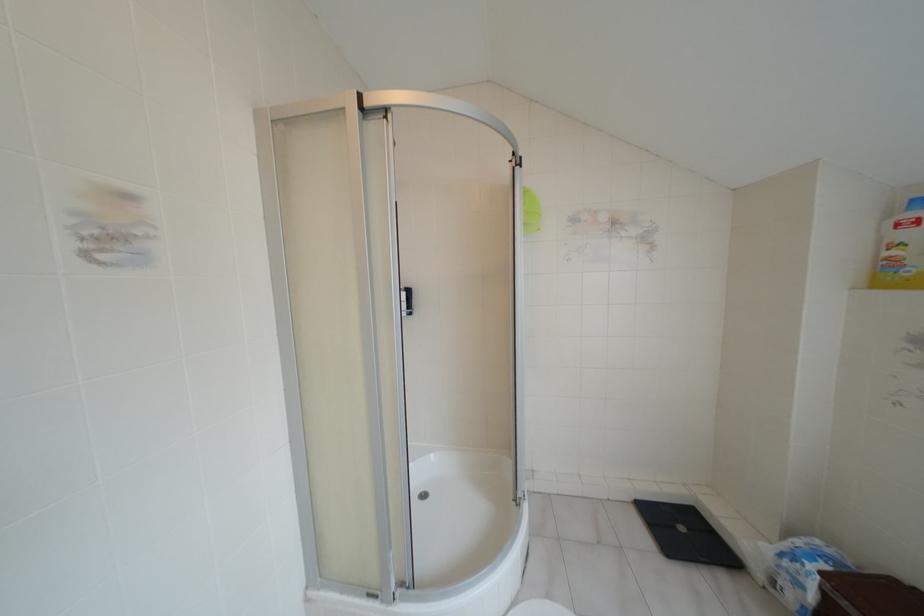
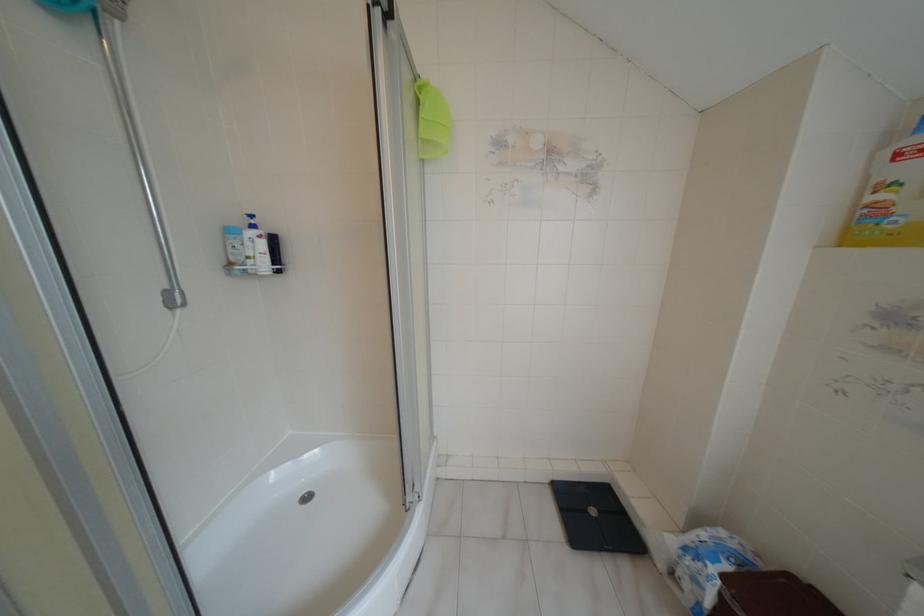
Find the pixel in the second image that matches the point at 408,314 in the first image.

(277, 270)